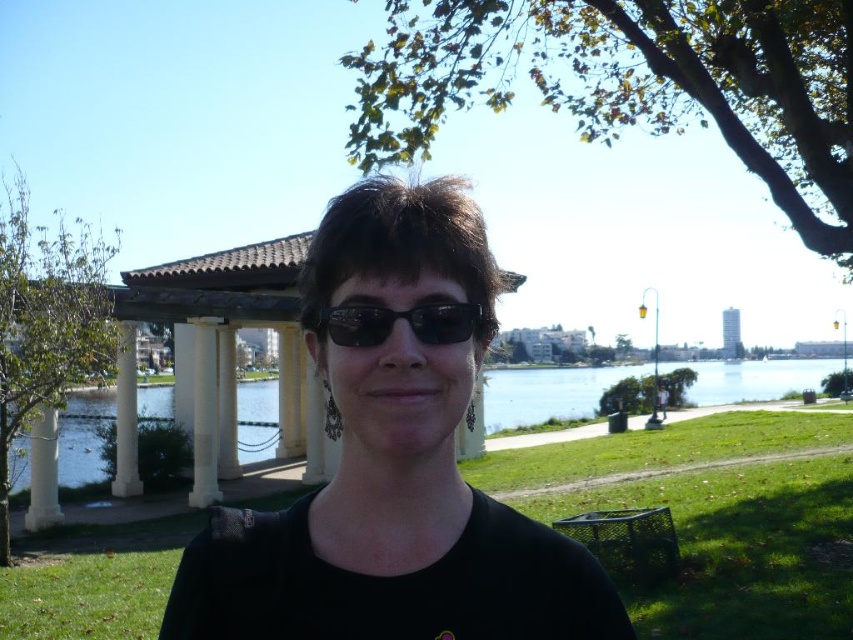
Between point (770, 364) and point (428, 312), which one is positioned in front?

Positioned in front is point (428, 312).

Which is behind, point (573, 369) or point (433, 317)?

The point (573, 369) is behind.

This screenshot has width=853, height=640. What do you see at coordinates (547, 392) in the screenshot? I see `clear blue water at center` at bounding box center [547, 392].

The image size is (853, 640). I want to click on clear blue water at center, so click(x=547, y=392).

Is black matte shirt at center positioned before clear blue water at center?

That is True.

Between point (363, 390) and point (724, 396), which one is positioned behind?

Point (724, 396)

In order to click on black matte shirt at center in this screenshot , I will do `click(392, 468)`.

Does black matte shirt at center have a larger size compared to black plastic sunglasses at center?

Correct, black matte shirt at center is larger in size than black plastic sunglasses at center.

Between black matte shirt at center and black plastic sunglasses at center, which one is positioned lower?

black matte shirt at center is lower down.

Which is behind, point (508, 582) or point (383, 308)?

The point (508, 582) is behind.

You are a GUI agent. You are given a task and a screenshot of the screen. Output one action in this format:
    pyautogui.click(x=<x>, y=<y>)
    Task: Click on the black matte shirt at center
    The image size is (853, 640).
    Given the screenshot: What is the action you would take?
    pyautogui.click(x=392, y=468)